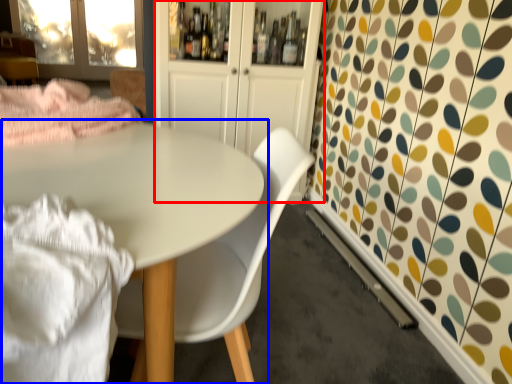
Question: Among these objects, which one is nearest to the camera, dresser (highlighted by a red box) or table (highlighted by a blue box)?

Choices:
 (A) dresser
 (B) table

Answer: (B)